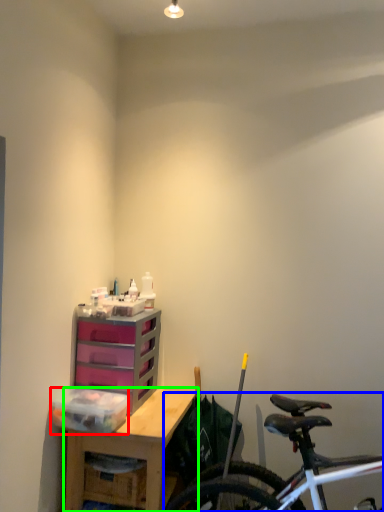
Question: Which object is the farthest from storage box (highlighted by a red box)? Choose among these: bicycle (highlighted by a blue box) or desk (highlighted by a green box).

Choices:
 (A) bicycle
 (B) desk

Answer: (A)